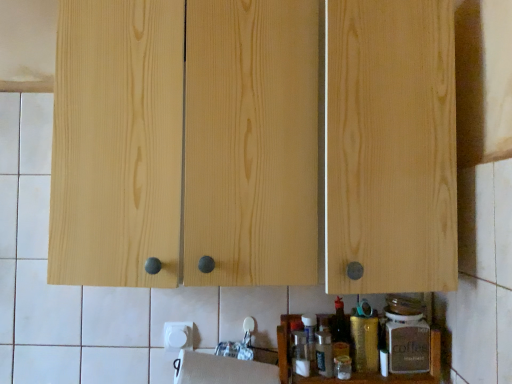
Question: Looking at the image, does natural wood cabinet at center seem bigger or smaller compared to wooden spice rack at lower center?

Choices:
 (A) small
 (B) big

Answer: (B)

Question: Do you think natural wood cabinet at center is within wooden spice rack at lower center, or outside of it?

Choices:
 (A) outside
 (B) inside

Answer: (A)

Question: Considering the real-world distances, which object is closest to the matte brown glass coffee jar at lower right, marked as the 1th bottle in a right-to-left arrangement?

Choices:
 (A) white matte paper towel at lower center
 (B) wooden spice rack at lower center
 (C) natural wood cabinet at center
 (D) gold metallic canister at lower center, the 2th bottle viewed from the right

Answer: (D)

Question: Which is farther from the white matte paper towel at lower center?

Choices:
 (A) wooden spice rack at lower center
 (B) gold metallic canister at lower center, the 2th bottle viewed from the right
 (C) natural wood cabinet at center
 (D) matte brown glass coffee jar at lower right, which ranks as the 2th bottle in left-to-right order

Answer: (C)